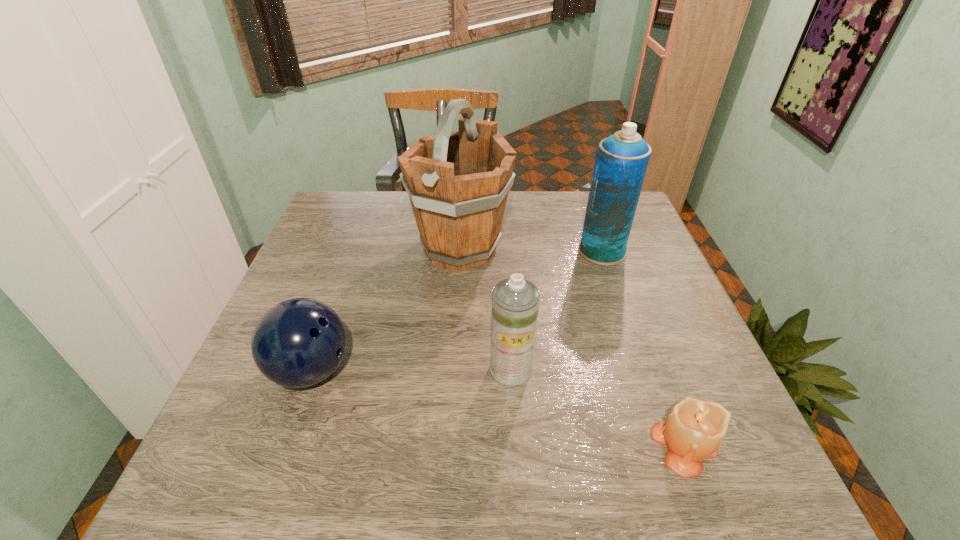
This screenshot has width=960, height=540. I want to click on bucket, so click(458, 182).

Where is `the right aerosol can`? The height and width of the screenshot is (540, 960). the right aerosol can is located at coordinates (621, 161).

You are a GUI agent. You are given a task and a screenshot of the screen. Output one action in this format:
    pyautogui.click(x=<x>, y=<y>)
    Task: Click on the farther aerosol can
    
    Given the screenshot: What is the action you would take?
    pyautogui.click(x=621, y=161)

Where is `the third tallest object`? the third tallest object is located at coordinates (515, 301).

Where is `the shorter aerosol can`? the shorter aerosol can is located at coordinates 515,301.

You are a GUI agent. You are given a task and a screenshot of the screen. Output one action in this format:
    pyautogui.click(x=<x>, y=<y>)
    Task: Click on the second shortest object
    
    Given the screenshot: What is the action you would take?
    pyautogui.click(x=297, y=343)

Find the location of `the leftmost object`. the leftmost object is located at coordinates (297, 343).

Locate an element on the screen. the shortest object is located at coordinates pos(693,431).

Locate an element on the screen. The width and height of the screenshot is (960, 540). candle is located at coordinates (693, 431).

The width and height of the screenshot is (960, 540). In order to click on vacant space located 0.280m on the front of the bucket in this screenshot , I will do click(453, 374).